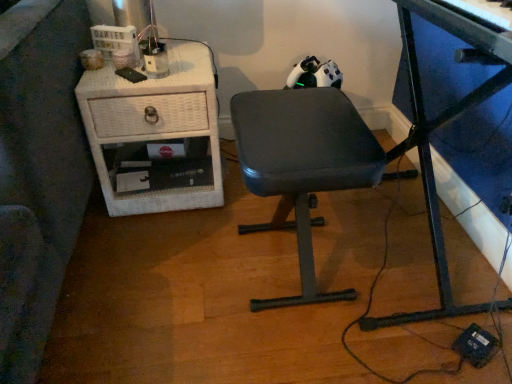
I want to click on vacant area situated below metallic blue desk at center (from a real-world perspective), so click(x=400, y=250).